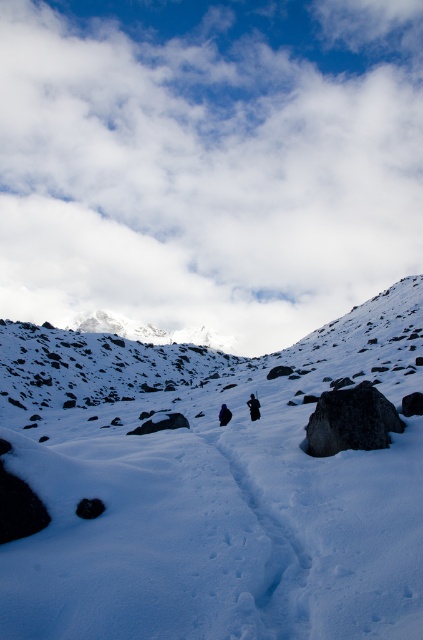
You are standing at the edge of the snowy terrain and see the white powdery snow at center and the black fabric person at center. Which object is closer to you?

The white powdery snow at center is closer to you because it is positioned in front of the black fabric person at center.

You are a hiker planning to walk across the white powdery snow at center and the black matte jacket at center. Which surface would be deeper to step into?

The white powdery snow at center is much taller than the black matte jacket at center, so stepping into the white powdery snow at center would be deeper.